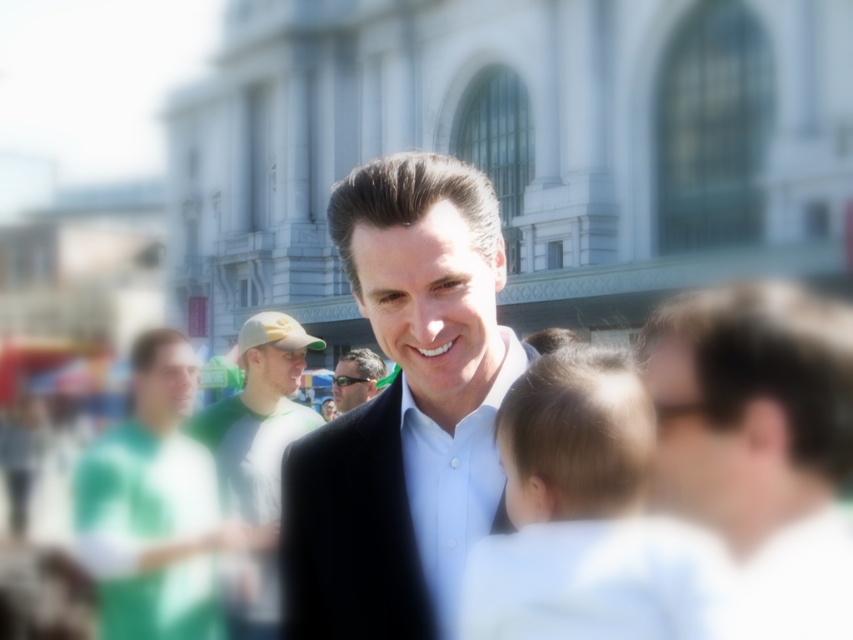
Question: Which of the following is the farthest from the observer?

Choices:
 (A) (352, 353)
 (B) (656, 340)
 (C) (482, 500)
 (D) (123, 515)

Answer: (A)

Question: Among these objects, which one is farthest from the camera?

Choices:
 (A) smooth brown hair at center
 (B) matte black sunglasses at center

Answer: (B)

Question: Can you confirm if green jersey at left is thinner than white smooth shirt at center?

Choices:
 (A) yes
 (B) no

Answer: (B)

Question: Can you confirm if black matte suit at center is thinner than white smooth shirt at center?

Choices:
 (A) yes
 (B) no

Answer: (B)

Question: Is smooth brown hair at center positioned behind white smooth shirt at center?

Choices:
 (A) no
 (B) yes

Answer: (A)

Question: Which of the following is the closest to the observer?

Choices:
 (A) (263, 592)
 (B) (461, 545)

Answer: (B)